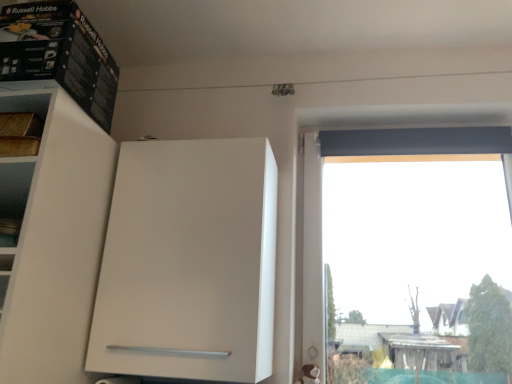
Question: Is point (2, 66) positioned closer to the camera than point (196, 205)?

Choices:
 (A) farther
 (B) closer

Answer: (B)

Question: In the image, is black cardboard box at upper left positioned in front of or behind white matte cabinet at center?

Choices:
 (A) behind
 (B) front

Answer: (B)

Question: From the image's perspective, is black cardboard box at upper left located above or below white matte cabinet at center?

Choices:
 (A) below
 (B) above

Answer: (B)

Question: Considering the positions of point (187, 218) and point (29, 46), is point (187, 218) closer or farther from the camera than point (29, 46)?

Choices:
 (A) closer
 (B) farther

Answer: (B)

Question: Is white matte cabinet at center to the left or to the right of black cardboard box at upper left in the image?

Choices:
 (A) right
 (B) left

Answer: (A)

Question: From a real-world perspective, relative to black cardboard box at upper left, is white matte cabinet at center vertically above or below?

Choices:
 (A) above
 (B) below

Answer: (B)

Question: From the image's perspective, is white matte cabinet at center above or below black cardboard box at upper left?

Choices:
 (A) above
 (B) below

Answer: (B)